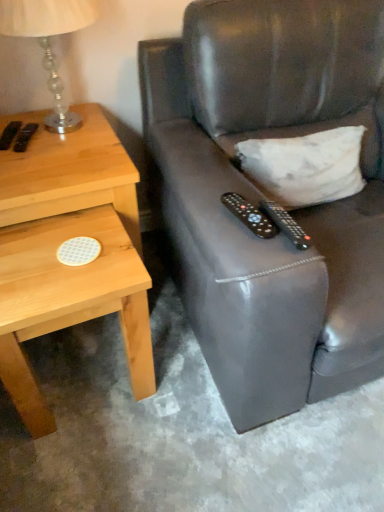
In order to click on unoccupied area in front of translucent glass lamp at upper left in this screenshot , I will do `click(61, 168)`.